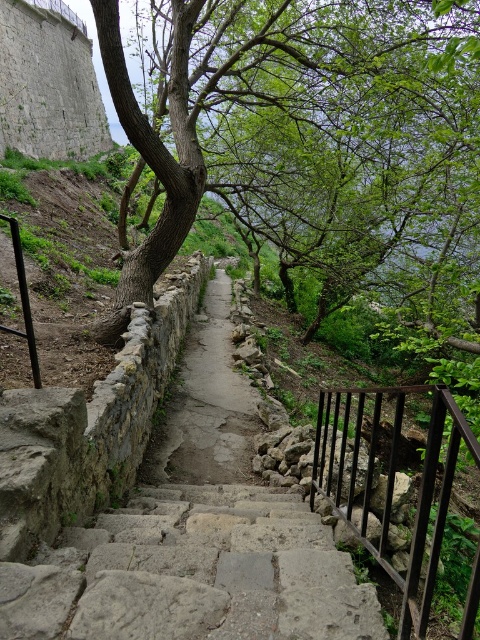
Based on the photo, which is more to the right, black metal railing at right or dull stone path at center?

From the viewer's perspective, black metal railing at right appears more on the right side.

Between point (357, 467) and point (211, 321), which one is positioned behind?

Point (211, 321)

Locate an element on the screen. black metal railing at right is located at coordinates (389, 480).

Describe the element at coordinates (309, 131) in the screenshot. I see `smooth brown tree trunk at center` at that location.

Is point (154, 252) behind point (255, 429)?

Yes, point (154, 252) is farther from viewer.

Is point (283, 84) positioned behind point (204, 310)?

No, it is not.

The width and height of the screenshot is (480, 640). I want to click on smooth brown tree trunk at center, so click(309, 131).

Which is above, smooth brown tree trunk at center or black metal railing at right?

smooth brown tree trunk at center is above.

Is point (208, 186) more distant than point (368, 474)?

Yes, point (208, 186) is farther from viewer.

The width and height of the screenshot is (480, 640). I want to click on smooth brown tree trunk at center, so click(x=309, y=131).

Image resolution: width=480 pixels, height=640 pixels. In order to click on smooth brown tree trunk at center in this screenshot , I will do `click(309, 131)`.